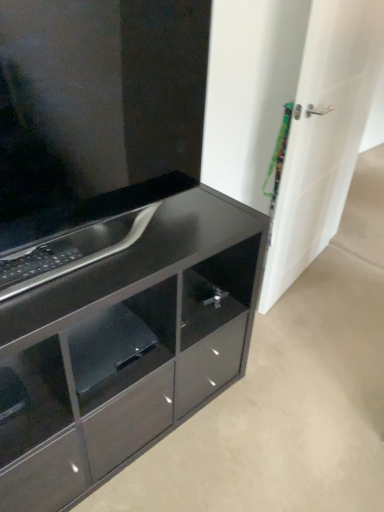
Locate an element on the screen. This screenshot has height=512, width=384. space that is in front of white glossy door at right is located at coordinates (319, 326).